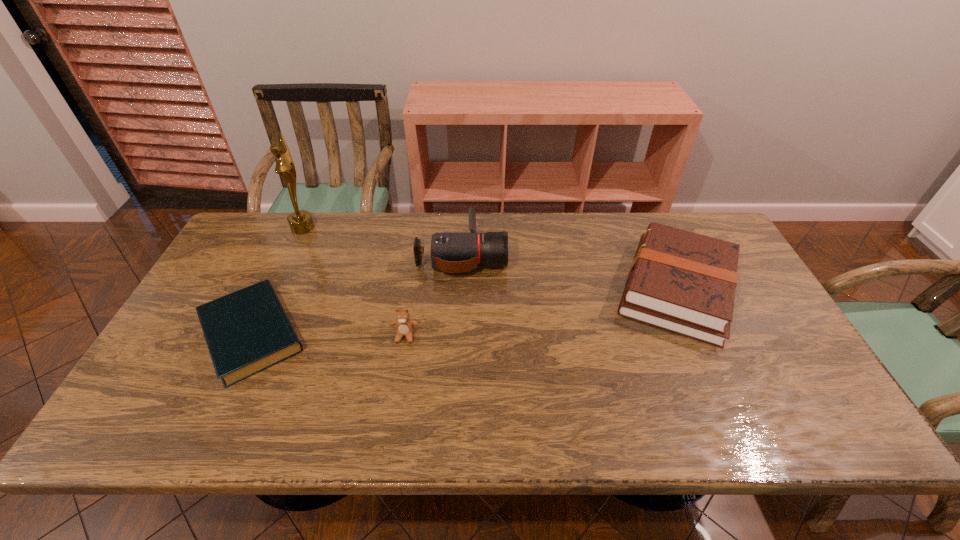
Locate an element on the screen. Image resolution: width=960 pixels, height=540 pixels. the tallest object is located at coordinates (300, 222).

Where is `camcorder`? The height and width of the screenshot is (540, 960). camcorder is located at coordinates pos(450,252).

Locate an element on the screen. The width and height of the screenshot is (960, 540). the taller book is located at coordinates (683, 282).

Find the location of a particular element. This screenshot has width=960, height=540. the right book is located at coordinates (683, 282).

The height and width of the screenshot is (540, 960). In order to click on teddy bear in this screenshot , I will do `click(404, 325)`.

The width and height of the screenshot is (960, 540). In order to click on the left book in this screenshot , I will do 247,331.

Image resolution: width=960 pixels, height=540 pixels. Identify the location of the shortest object. (247, 331).

Find the location of a particular element. The height and width of the screenshot is (540, 960). vacant space situated on the front-facing side of the tallest object is located at coordinates (329, 227).

Locate an element on the screen. The height and width of the screenshot is (540, 960). free space located on the lens of the camcorder is located at coordinates (591, 254).

This screenshot has width=960, height=540. I want to click on vacant area situated on the front of the taller book, so click(720, 386).